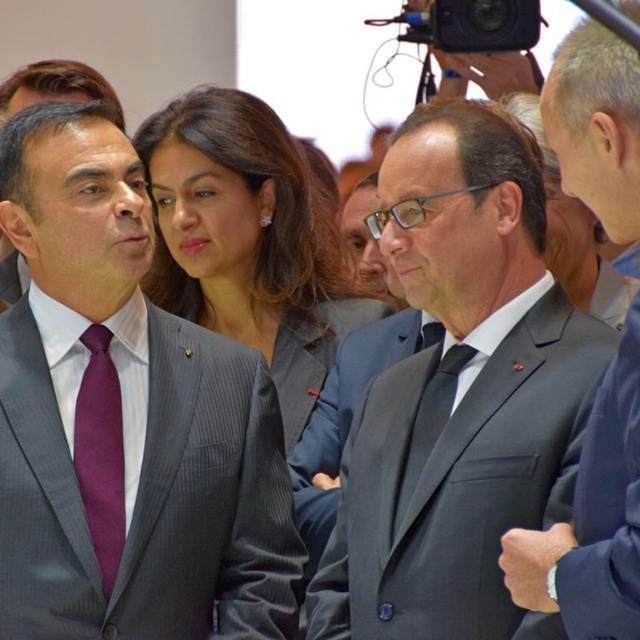
Question: Which object appears farthest from the camera in this image?

Choices:
 (A) satin gray suit at center
 (B) purple tie at left
 (C) matte gray suit at center
 (D) purple satin tie at left

Answer: (A)

Question: Which point is farther from the camera taking this photo?

Choices:
 (A) (458, 104)
 (B) (29, 268)
 (C) (513, 596)
 (D) (333, 301)

Answer: (D)

Question: Based on their relative distances, which object is nearer to the purple tie at left?

Choices:
 (A) purple satin tie at left
 (B) matte gray suit at center
 (C) satin gray suit at center
 (D) dark gray suit at center

Answer: (A)

Question: Can you confirm if matte gray suit at center is smaller than purple satin tie at left?

Choices:
 (A) yes
 (B) no

Answer: (B)

Question: Is purple tie at left smaller than purple satin tie at left?

Choices:
 (A) yes
 (B) no

Answer: (B)

Question: Does matte gray suit at center have a smaller size compared to dark gray suit at center?

Choices:
 (A) yes
 (B) no

Answer: (B)